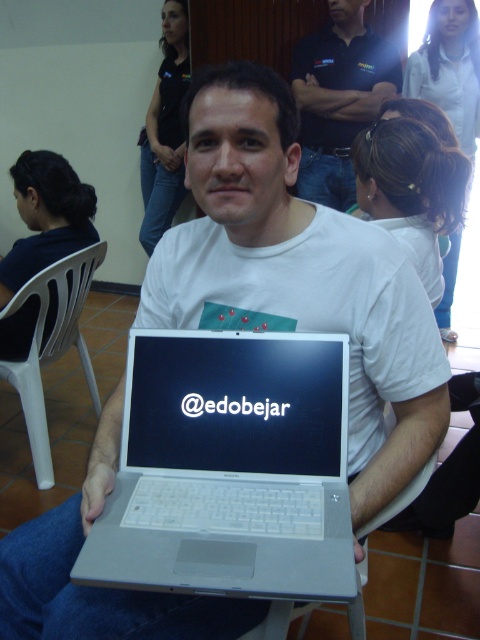
Question: Based on their relative distances, which object is farther from the white plastic chair at lower center?

Choices:
 (A) matte white hair at upper center
 (B) white plastic chair at lower left
 (C) dark blue shirt at upper center
 (D) silver metallic laptop at center

Answer: (A)

Question: Which of the following is the farthest from the observer?

Choices:
 (A) white plastic chair at lower center
 (B) black shirt at upper center
 (C) silver metallic laptop at center

Answer: (B)

Question: Observing the image, what is the correct spatial positioning of dark blue shirt at upper center in reference to matte white hair at upper center?

Choices:
 (A) right
 (B) left

Answer: (B)

Question: Which point is closer to the camera?

Choices:
 (A) pos(177,122)
 (B) pos(454,64)
 (C) pos(357,576)
 (D) pos(159,500)

Answer: (C)

Question: Can you confirm if silver metallic laptop at center is positioned to the left of black shirt at upper center?

Choices:
 (A) yes
 (B) no

Answer: (B)

Question: Does silver metallic laptop at center have a larger size compared to black shirt at upper center?

Choices:
 (A) no
 (B) yes

Answer: (A)